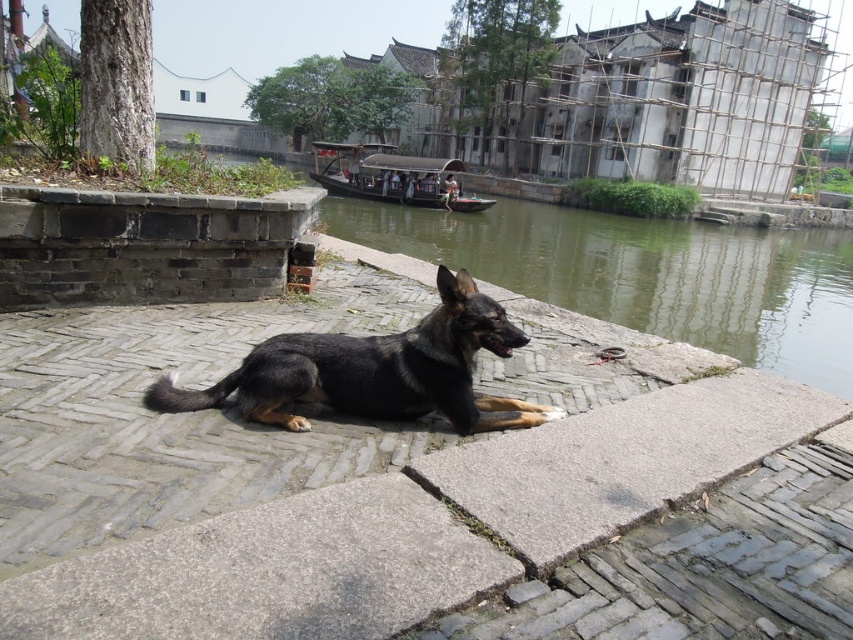
Who is more forward, (514, 289) or (384, 346)?

Point (384, 346) is in front.

Is point (552, 250) less distant than point (467, 368)?

No, (552, 250) is behind (467, 368).

I want to click on greenish water at lower center, so click(x=647, y=275).

Between greenish water at lower center and wooden boat at center, which one has more height?

Standing taller between the two is greenish water at lower center.

Is greenish water at lower center positioned in front of wooden boat at center?

Yes.

Locate an element on the screen. greenish water at lower center is located at coordinates (647, 275).

In the scene shown: Can you confirm if shiny black fur at center is wider than wooden boat at center?

In fact, shiny black fur at center might be narrower than wooden boat at center.

Can you confirm if shiny black fur at center is bigger than wooden boat at center?

No.

Between point (419, 324) and point (432, 176), which one is positioned in front?

Point (419, 324) is more forward.

At what (x,y) coordinates should I click in order to perform the action: click on shiny black fur at center. Please return your answer as a coordinate pair (x, y). This screenshot has height=640, width=853. Looking at the image, I should click on (376, 371).